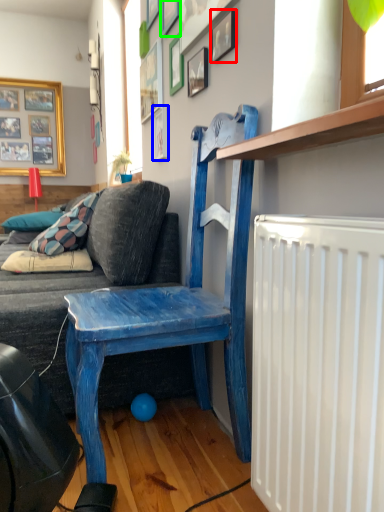
Question: Estimate the real-world distances between objects in this image. Which object is closer to picture frame (highlighted by a red box), picture frame (highlighted by a blue box) or picture frame (highlighted by a green box)?

Choices:
 (A) picture frame
 (B) picture frame

Answer: (B)